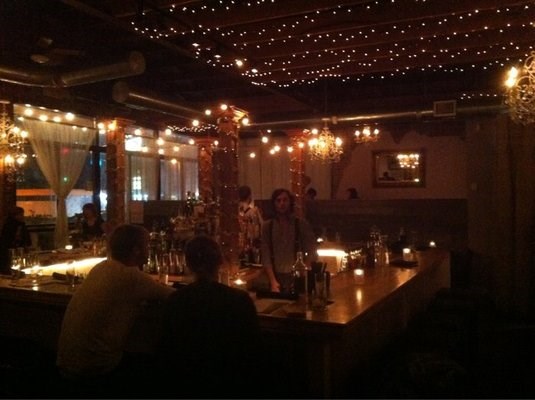
What are the coordinates of `tied window curtain` in the screenshot? It's located at (61, 198).